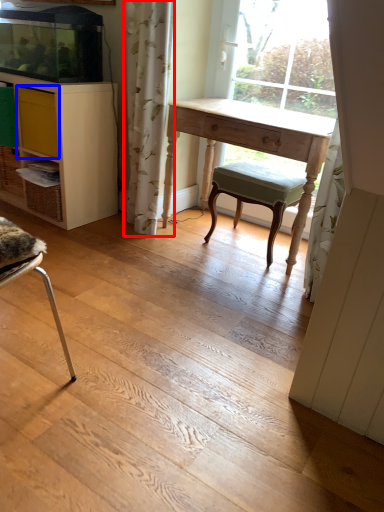
Question: Which of the following is the closest to the observer, curtain (highlighted by a red box) or drawer (highlighted by a blue box)?

Choices:
 (A) curtain
 (B) drawer

Answer: (A)